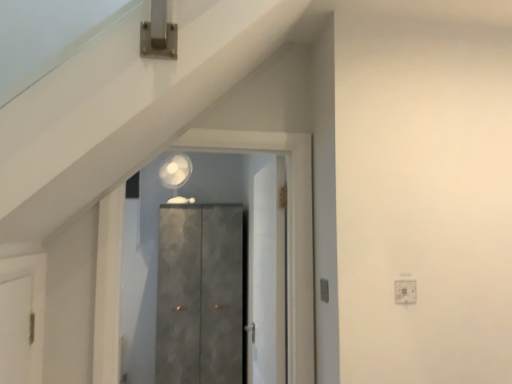
Question: Is matte gray cabinet at center, which appears as the 1th door when viewed from the back, closer to camera compared to white matte door at center, placed as the 2th door when sorted from front to back?

Choices:
 (A) no
 (B) yes

Answer: (A)

Question: Can you confirm if matte gray cabinet at center, the third door from the front, is wider than white matte door at center, which ranks as the 2th door in back-to-front order?

Choices:
 (A) no
 (B) yes

Answer: (B)

Question: Is matte gray cabinet at center, which appears as the 1th door when viewed from the back, turned away from white matte door at center, which ranks as the 2th door in back-to-front order?

Choices:
 (A) yes
 (B) no

Answer: (B)

Question: Does matte gray cabinet at center, which appears as the 1th door when viewed from the back, have a larger size compared to white matte door at center, placed as the 2th door when sorted from front to back?

Choices:
 (A) yes
 (B) no

Answer: (A)

Question: Is matte gray cabinet at center, which appears as the 1th door when viewed from the back, at the right side of white matte door at center, which ranks as the 2th door in back-to-front order?

Choices:
 (A) yes
 (B) no

Answer: (B)

Question: From a real-world perspective, does matte gray cabinet at center, which appears as the 1th door when viewed from the back, stand above white matte door at center, placed as the 2th door when sorted from front to back?

Choices:
 (A) yes
 (B) no

Answer: (B)

Question: Is white matte door at center, which ranks as the 2th door in back-to-front order, aimed at matte gray cabinet at center, the third door from the front?

Choices:
 (A) no
 (B) yes

Answer: (A)

Question: Is matte gray cabinet at center, the third door from the front, located within white matte door at center, placed as the 2th door when sorted from front to back?

Choices:
 (A) no
 (B) yes

Answer: (A)

Question: Is white matte door at center, which ranks as the 2th door in back-to-front order, not near matte gray cabinet at center, which appears as the 1th door when viewed from the back?

Choices:
 (A) yes
 (B) no

Answer: (A)

Question: Is white matte door at center, which ranks as the 2th door in back-to-front order, completely or partially outside of matte gray cabinet at center, which appears as the 1th door when viewed from the back?

Choices:
 (A) yes
 (B) no

Answer: (A)

Question: Is white matte door at center, which ranks as the 2th door in back-to-front order, wider than matte gray cabinet at center, which appears as the 1th door when viewed from the back?

Choices:
 (A) yes
 (B) no

Answer: (B)

Question: Is white matte door at center, placed as the 2th door when sorted from front to back, further to the viewer compared to matte gray cabinet at center, the third door from the front?

Choices:
 (A) yes
 (B) no

Answer: (B)

Question: From the image's perspective, would you say white matte door at center, placed as the 2th door when sorted from front to back, is shown under matte gray cabinet at center, which appears as the 1th door when viewed from the front?

Choices:
 (A) no
 (B) yes

Answer: (B)